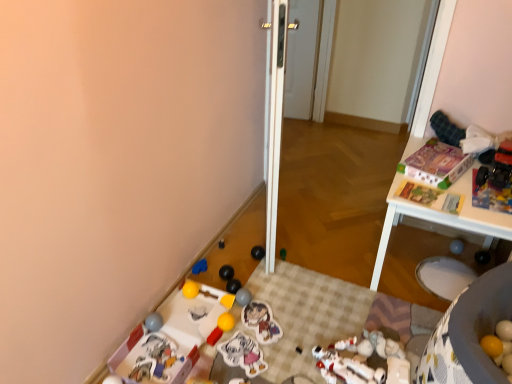
Where is `vacant area situated to the left side of yellow matte toy at lower center, which is counted as the eighth toy, starting from the left`? vacant area situated to the left side of yellow matte toy at lower center, which is counted as the eighth toy, starting from the left is located at coordinates 190,307.